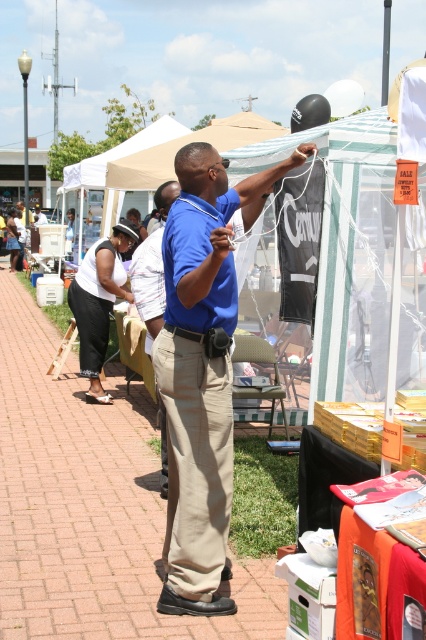
Question: Does blue cotton shirt at center appear under blue smooth shirt at center?

Choices:
 (A) yes
 (B) no

Answer: (A)

Question: Which object is positioned farthest from the white mesh canopy at upper center?

Choices:
 (A) white cotton pants at left
 (B) blue cotton shirt at center

Answer: (B)

Question: Does white cotton pants at left appear under blue smooth shirt at center?

Choices:
 (A) yes
 (B) no

Answer: (A)

Question: Which object appears closest to the camera in this image?

Choices:
 (A) white cotton pants at left
 (B) blue smooth shirt at center
 (C) blue cotton shirt at center
 (D) white mesh canopy at upper center

Answer: (C)

Question: Can you confirm if blue cotton shirt at center is smaller than white cotton pants at left?

Choices:
 (A) yes
 (B) no

Answer: (B)

Question: Which point appears closest to the camera in this image?

Choices:
 (A) (210, 321)
 (B) (230, 147)
 (C) (157, 285)

Answer: (A)